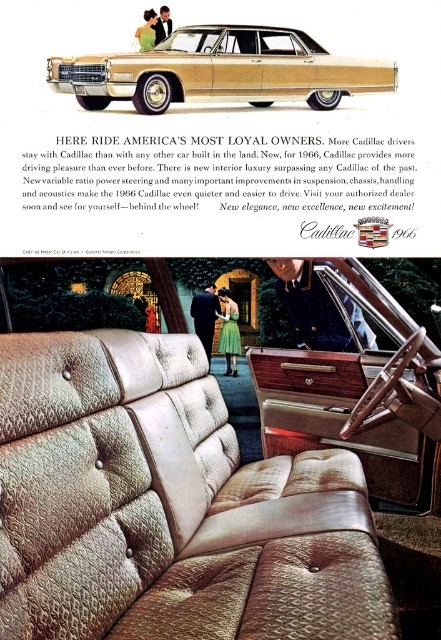
Question: Is beige textured leather couch at center wider than gold textured car at center?

Choices:
 (A) no
 (B) yes

Answer: (B)

Question: Which object is positioned closest to the beige textured leather couch at center?

Choices:
 (A) beige textured leather interior at center
 (B) gold textured car at center

Answer: (A)

Question: From the image, what is the correct spatial relationship of beige textured leather couch at center in relation to gold textured car at center?

Choices:
 (A) left
 (B) right

Answer: (A)

Question: Is beige textured leather couch at center positioned in front of gold textured car at center?

Choices:
 (A) no
 (B) yes

Answer: (B)

Question: Which is nearer to the beige textured leather couch at center?

Choices:
 (A) gold textured car at center
 (B) beige textured leather interior at center

Answer: (B)

Question: Which point is closer to the camera?

Choices:
 (A) beige textured leather interior at center
 (B) gold textured car at center
 (C) beige textured leather couch at center

Answer: (C)